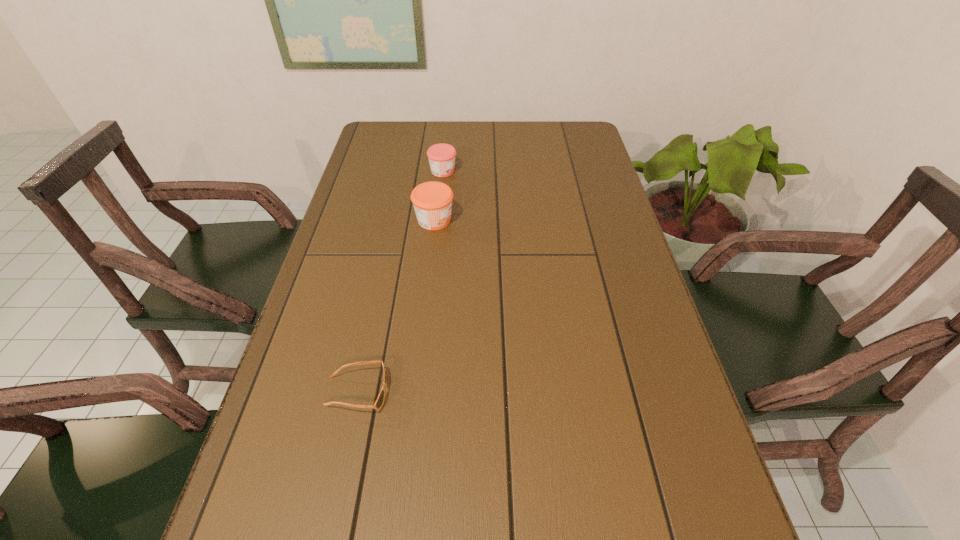
This screenshot has height=540, width=960. In order to click on free space at the far edge of the desktop in this screenshot , I will do `click(454, 125)`.

Find the location of a particular element. The height and width of the screenshot is (540, 960). vacant area at the left edge is located at coordinates (340, 472).

The height and width of the screenshot is (540, 960). In the image, there is a desktop. In order to click on vacant space at the right edge in this screenshot , I will do `click(587, 245)`.

What are the coordinates of `vacant area at the far left corner` in the screenshot? It's located at (405, 137).

In order to click on free spot between the shortest object and the taller jam in this screenshot , I will do `click(396, 306)`.

Locate which object is the closest to the shortest object. Please provide its 2D coordinates. Your answer should be formatted as a tuple, i.e. [(x, y)], where the tuple contains the x and y coordinates of a point satisfying the conditions above.

[(432, 201)]

The height and width of the screenshot is (540, 960). In order to click on object that stands as the second closest to the tallest object in this screenshot , I will do `click(379, 402)`.